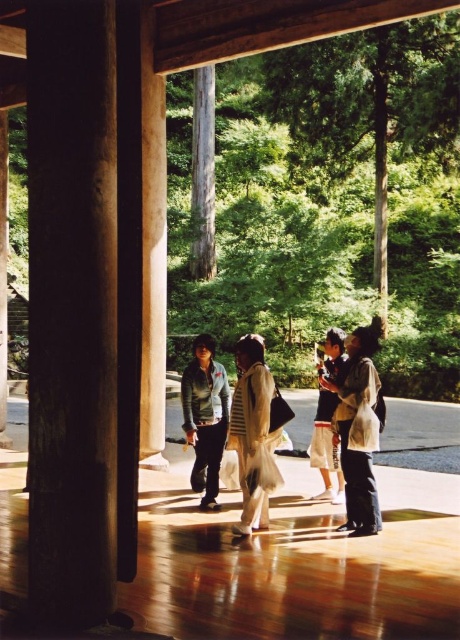
Is white textured coat at center above white textured scarf at center?

Actually, white textured coat at center is below white textured scarf at center.

Does point (356, 476) come behind point (264, 419)?

That is True.

This screenshot has height=640, width=460. I want to click on white textured coat at center, so coord(358,429).

Who is higher up, smooth wood pillar at left or white textured scarf at center?

smooth wood pillar at left

Between point (154, 81) and point (231, 438), which one is positioned behind?

Point (154, 81)

Where is `smooth wood pillar at left`? This screenshot has height=640, width=460. smooth wood pillar at left is located at coordinates (153, 253).

Locate an element on the screen. The image size is (460, 640). smooth brown wood pillar at left is located at coordinates (72, 308).

Is point (59, 608) behind point (211, 156)?

No, (59, 608) is in front of (211, 156).

Where is `smooth brown wood pillar at left`? The image size is (460, 640). smooth brown wood pillar at left is located at coordinates (72, 308).